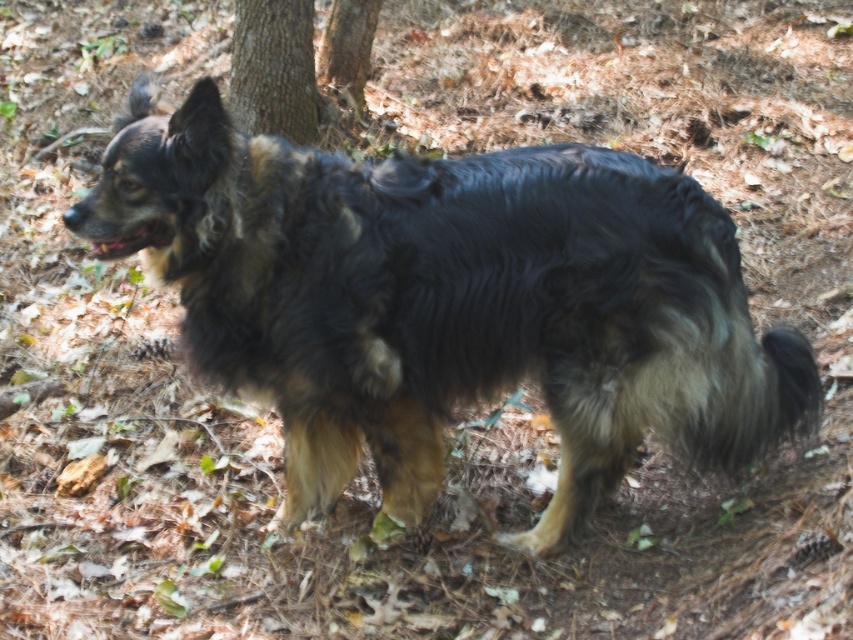
From the picture: You are a hiker trying to navigate through the wooded area where the dog is standing. You need to move from point A to point B. According to the image, which point is closer to you, point A at coordinates point A is point (393,192) or point B at coordinates point B is point (352,96)?

Point A at coordinates point A is point (393,192) is closer to you because it is in front of point B at coordinates point B is point (352,96).

You are a hiker who just arrived at the forest clearing. You see the shaggy brown dog at center and the brown rough bark at center. Which object is positioned more to the right side of the clearing?

The shaggy brown dog at center is positioned to the right of the brown rough bark at center, so the shaggy brown dog at center is more to the right side of the clearing.